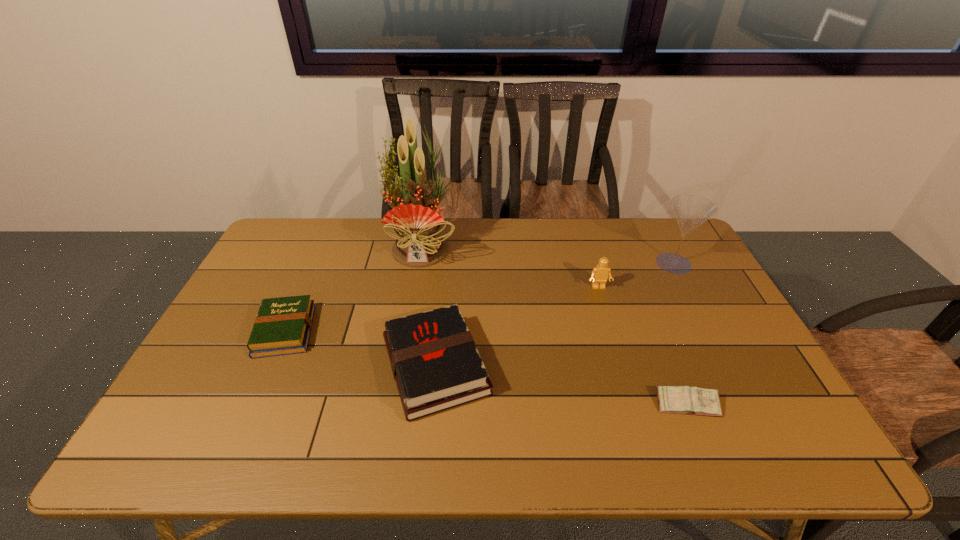
Where is `flower arrangement`? This screenshot has width=960, height=540. flower arrangement is located at coordinates (419, 243).

I want to click on flute glass, so click(691, 211).

Locate an element on the screen. This screenshot has width=960, height=540. the rightmost object is located at coordinates (691, 211).

Where is `Lego`? This screenshot has width=960, height=540. Lego is located at coordinates (600, 273).

Find the location of a particular element. the fourth object from left to right is located at coordinates (600, 273).

You are a GUI agent. You are given a task and a screenshot of the screen. Output one action in this format:
    pyautogui.click(x=<x>, y=<y>)
    Task: Click on the hardback book
    
    Given the screenshot: What is the action you would take?
    pyautogui.click(x=435, y=363)

The width and height of the screenshot is (960, 540). I want to click on the leftmost object, so click(283, 325).

The image size is (960, 540). Find the location of `the second object from right to left`. the second object from right to left is located at coordinates (688, 400).

Identify the location of free location located in front of the flower arrangement with the fan visible. This screenshot has height=540, width=960. (402, 372).

Find the location of a particular element. The width and height of the screenshot is (960, 540). free space located 0.270m on the front of the fifth shortest object is located at coordinates (714, 341).